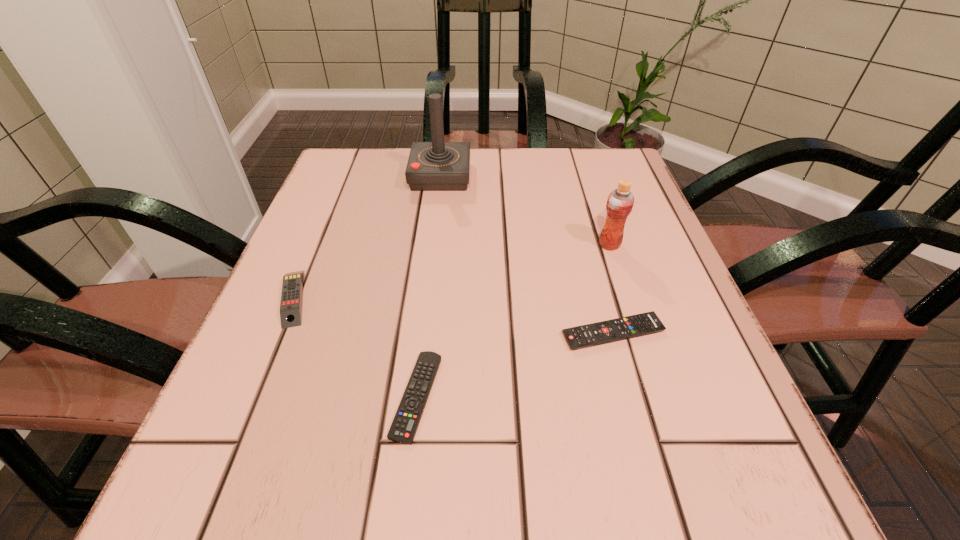
Image resolution: width=960 pixels, height=540 pixels. I want to click on vacant area located on the rectangular base of the farthest object, so click(x=554, y=176).

Image resolution: width=960 pixels, height=540 pixels. Identify the location of vacant space situated 0.350m on the front of the orange juice. (667, 420).

What are the coordinates of `vacant area situated on the right of the third tallest object` in the screenshot? It's located at (427, 298).

Locate an element on the screen. free spot located on the left of the rightmost remote control is located at coordinates (468, 333).

The image size is (960, 540). I want to click on free space located on the back of the nearest object, so pos(436,233).

You are a GUI agent. You are given a task and a screenshot of the screen. Output one action in this format:
    pyautogui.click(x=<x>, y=<y>)
    Task: Click on the object that is at the far edge
    The image size is (960, 540).
    Given the screenshot: What is the action you would take?
    pyautogui.click(x=432, y=166)

Locate an element on the screen. The height and width of the screenshot is (540, 960). object that is positioned at the left edge is located at coordinates (291, 297).

This screenshot has height=540, width=960. I want to click on orange juice present at the right edge, so click(620, 201).

Identify the location of remote control at the right edge. The width and height of the screenshot is (960, 540). (633, 326).

Locate an element on the screen. The width and height of the screenshot is (960, 540). vacant space at the far edge of the desktop is located at coordinates (519, 181).